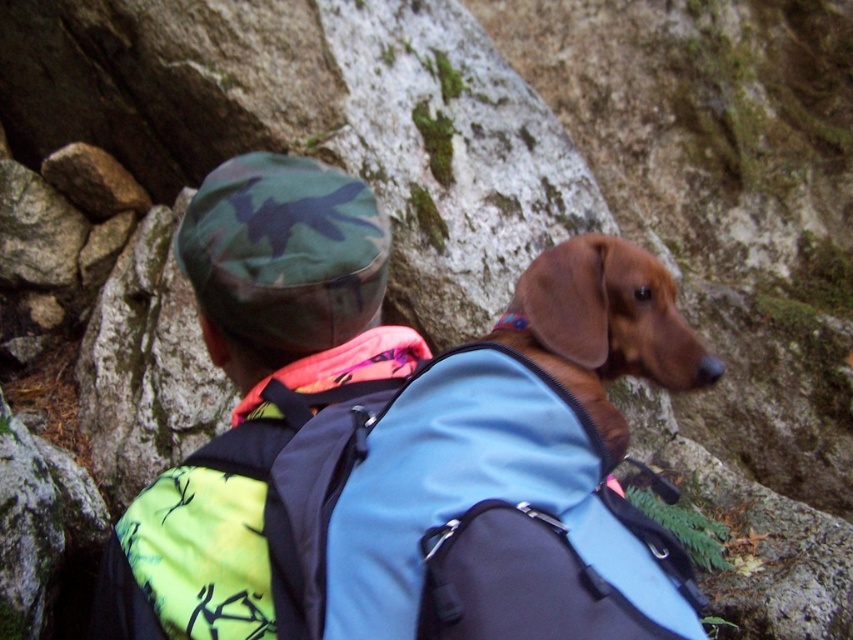
Question: Can you confirm if camo fabric hat at upper center is positioned to the left of brown smooth dog at center?

Choices:
 (A) yes
 (B) no

Answer: (A)

Question: Can you confirm if camo fabric hat at upper center is bigger than brown smooth dog at center?

Choices:
 (A) yes
 (B) no

Answer: (A)

Question: Does camo fabric hat at upper center have a larger size compared to brown smooth dog at center?

Choices:
 (A) no
 (B) yes

Answer: (B)